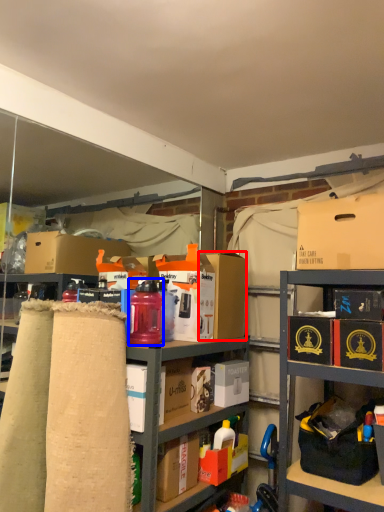
Question: Which point is further to the camera, cardboard box (highlighted by a red box) or bottle (highlighted by a blue box)?

Choices:
 (A) cardboard box
 (B) bottle

Answer: (A)